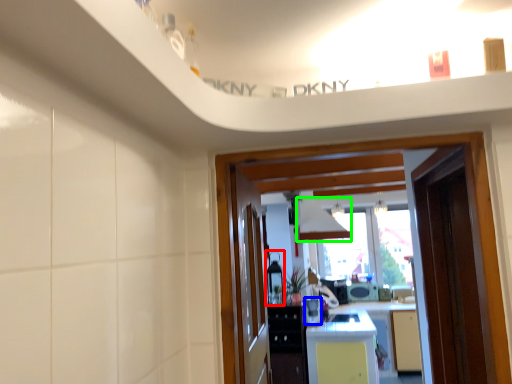
Question: Which object is positioned farthest from appliance (highlighted by a red box)? Select from appliance (highlighted by a blue box) and exhaust hood (highlighted by a green box).

Choices:
 (A) appliance
 (B) exhaust hood

Answer: (B)